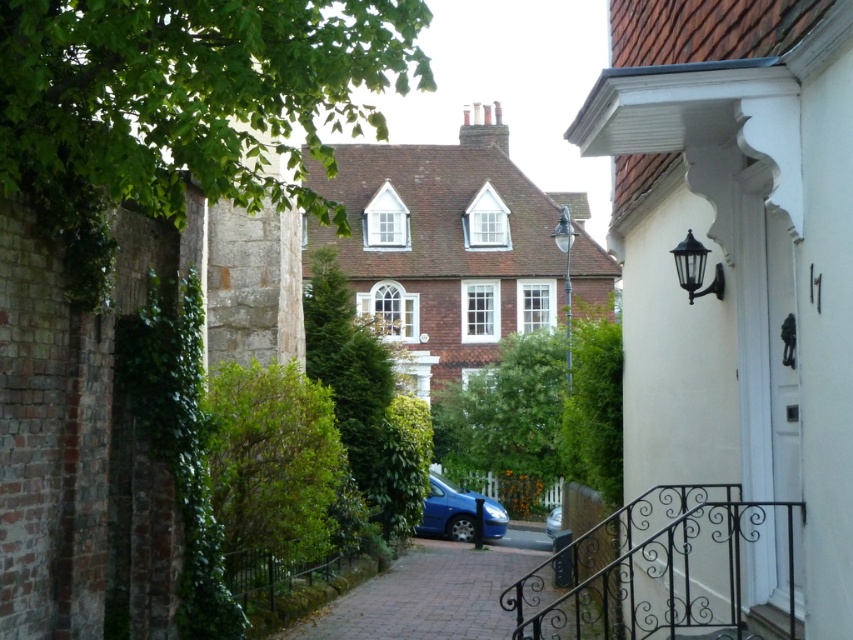
Is brick paved driveway at center bigger than metallic blue car at center?

Indeed, brick paved driveway at center has a larger size compared to metallic blue car at center.

Does point (390, 600) lie behind point (555, 534)?

No, (390, 600) is closer to viewer.

What are the coordinates of `brick paved driveway at center` in the screenshot? It's located at (430, 593).

Can you confirm if brick paved driveway at center is positioned below blue metallic car at center?

Yes.

Which is in front, point (428, 627) or point (448, 500)?

Point (428, 627) is in front.

Does point (448, 612) lie behind point (434, 492)?

No, (448, 612) is in front of (434, 492).

Where is `brick paved driveway at center`? The width and height of the screenshot is (853, 640). brick paved driveway at center is located at coordinates (430, 593).

From the picture: Is the position of blue metallic car at center more distant than that of metallic blue car at center?

No, it is not.

Who is shorter, blue metallic car at center or metallic blue car at center?

blue metallic car at center

The height and width of the screenshot is (640, 853). In order to click on blue metallic car at center in this screenshot , I will do `click(457, 513)`.